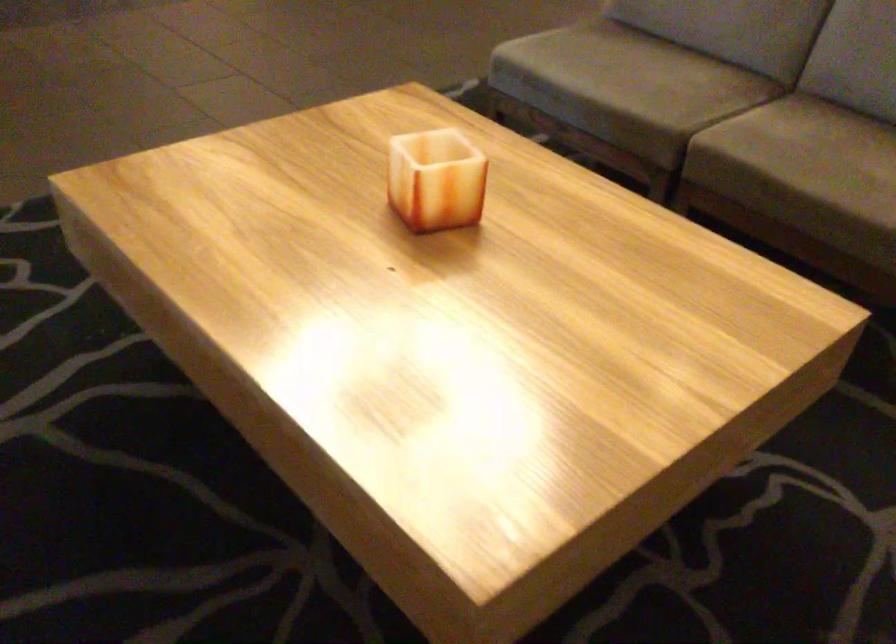
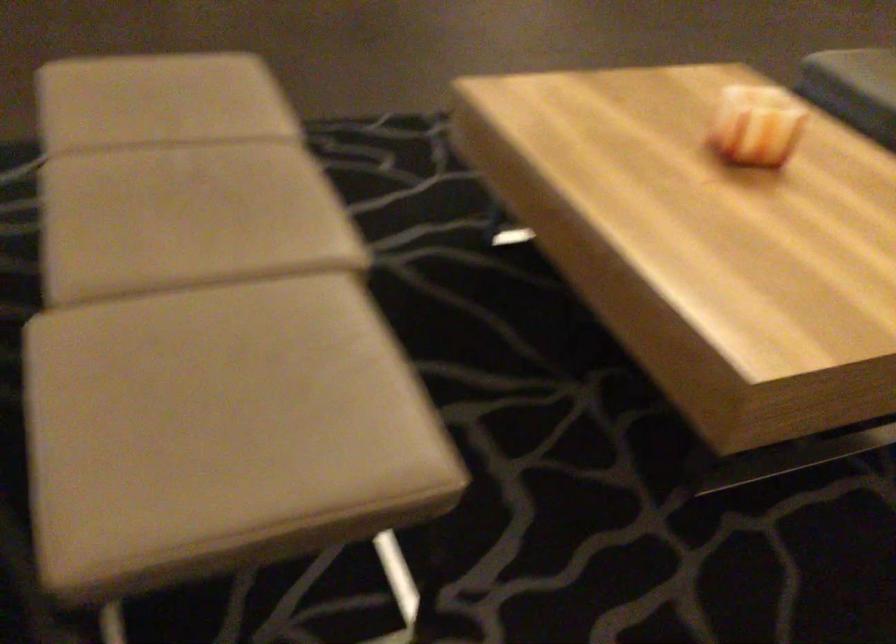
Question: The images are taken continuously from a first-person perspective. In which direction are you moving?

Choices:
 (A) Left
 (B) Right
 (C) Forward
 (D) Backward

Answer: (D)